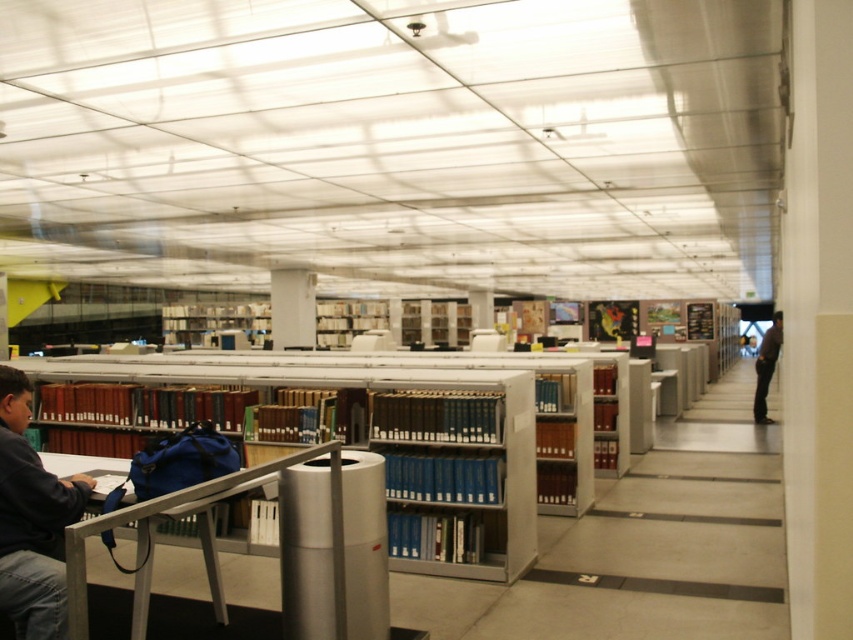
Question: Does blue plastic bookshelf at center appear under dark brown leather jacket at right?

Choices:
 (A) yes
 (B) no

Answer: (B)

Question: Which point is closer to the camera?

Choices:
 (A) (512, 381)
 (B) (759, 346)

Answer: (A)

Question: Can you confirm if blue plastic bookshelf at center is bigger than dark brown leather jacket at right?

Choices:
 (A) no
 (B) yes

Answer: (A)

Question: Which point is farther to the camera?

Choices:
 (A) (15, 369)
 (B) (508, 419)

Answer: (B)

Question: Which of the following is the closest to the observer?

Choices:
 (A) dark brown leather jacket at right
 (B) dark blue jacket at lower left
 (C) blue plastic bookshelf at center

Answer: (B)

Question: Is blue plastic bookshelf at center positioned in front of dark blue jacket at lower left?

Choices:
 (A) no
 (B) yes

Answer: (A)